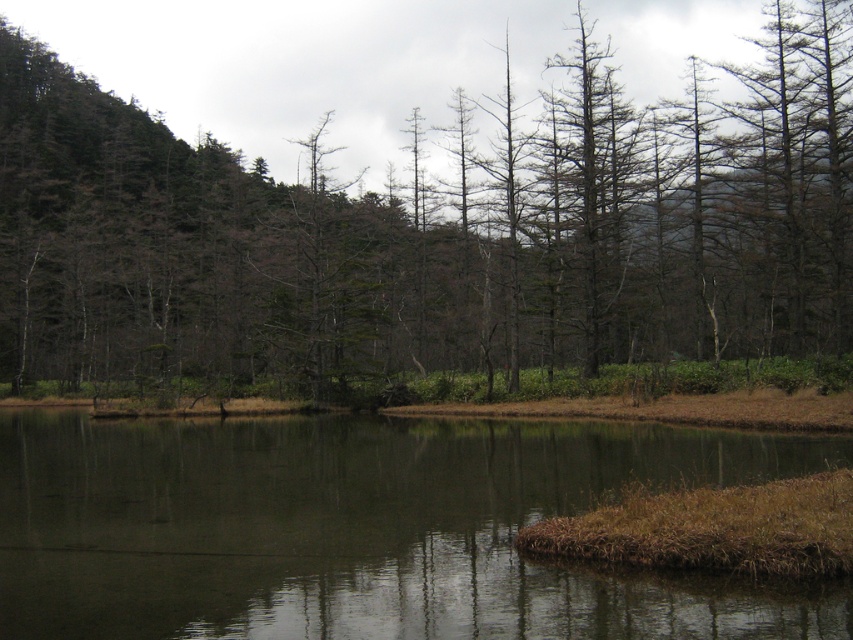
Question: Which point is farther to the camera?

Choices:
 (A) (740, 310)
 (B) (543, 504)

Answer: (A)

Question: Can you confirm if brown matte tree at center is bigger than dark reflective water at center?

Choices:
 (A) no
 (B) yes

Answer: (B)

Question: Which of the following is the closest to the observer?

Choices:
 (A) brown matte tree at center
 (B) dark reflective water at center

Answer: (B)

Question: Is brown matte tree at center positioned in front of dark reflective water at center?

Choices:
 (A) yes
 (B) no

Answer: (B)

Question: Among these objects, which one is nearest to the camera?

Choices:
 (A) brown matte tree at center
 (B) dark reflective water at center

Answer: (B)

Question: Can you confirm if brown matte tree at center is positioned above dark reflective water at center?

Choices:
 (A) yes
 (B) no

Answer: (A)